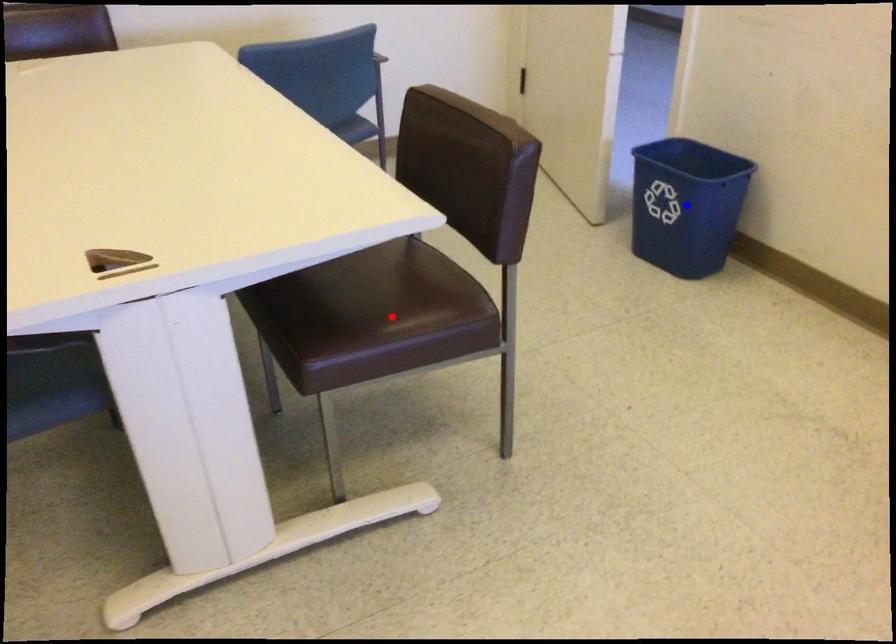
Question: Which of the two points in the image is closer to the camera?

Choices:
 (A) Blue point is closer.
 (B) Red point is closer.

Answer: (B)